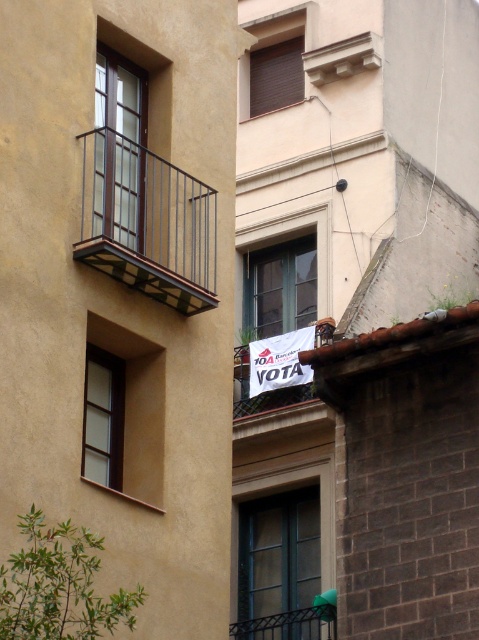
You are an architect inspecting the building facade. You notice the brown matte window at upper center and the smooth stone balcony at upper center. Which one is positioned higher up on the building?

The smooth stone balcony at upper center is positioned higher up on the building than the brown matte window at upper center because the brown matte window at upper center is below it.

You are standing in front of the residential building and want to know if the brown matte window at upper center is above the matte glass window at left. Can you confirm this based on the building layout?

Yes, the brown matte window at upper center is positioned over the matte glass window at left, so it is indeed above it.